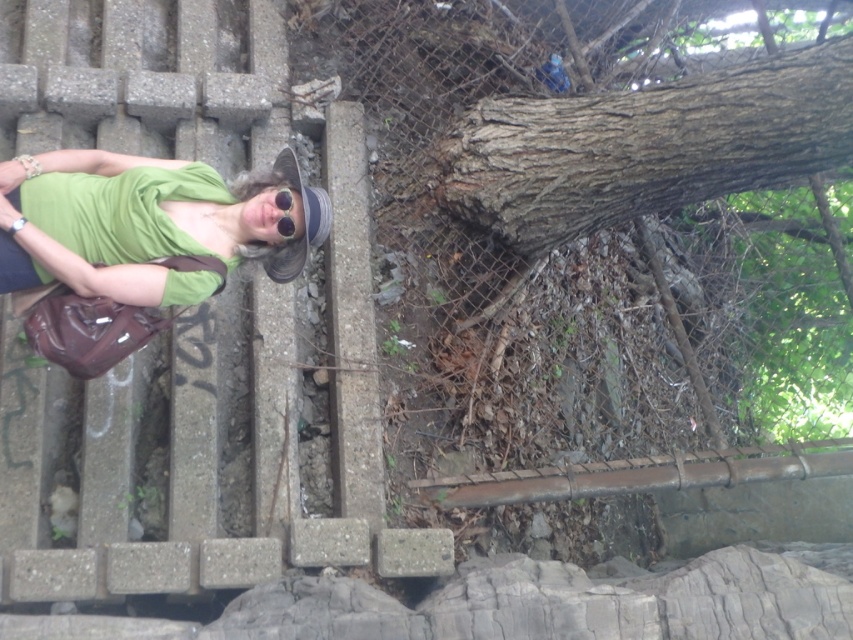
Question: Which point is closer to the camera taking this photo?

Choices:
 (A) (289, 208)
 (B) (252, 202)

Answer: (A)

Question: Does green matte shirt at left lie in front of black matte sunglasses at center?

Choices:
 (A) no
 (B) yes

Answer: (B)

Question: Which object is closer to the camera taking this photo?

Choices:
 (A) black matte sunglasses at center
 (B) green matte shirt at left

Answer: (B)

Question: Does green matte shirt at left appear on the right side of black matte sunglasses at center?

Choices:
 (A) no
 (B) yes

Answer: (A)

Question: Does green matte shirt at left have a larger size compared to black matte sunglasses at center?

Choices:
 (A) no
 (B) yes

Answer: (B)